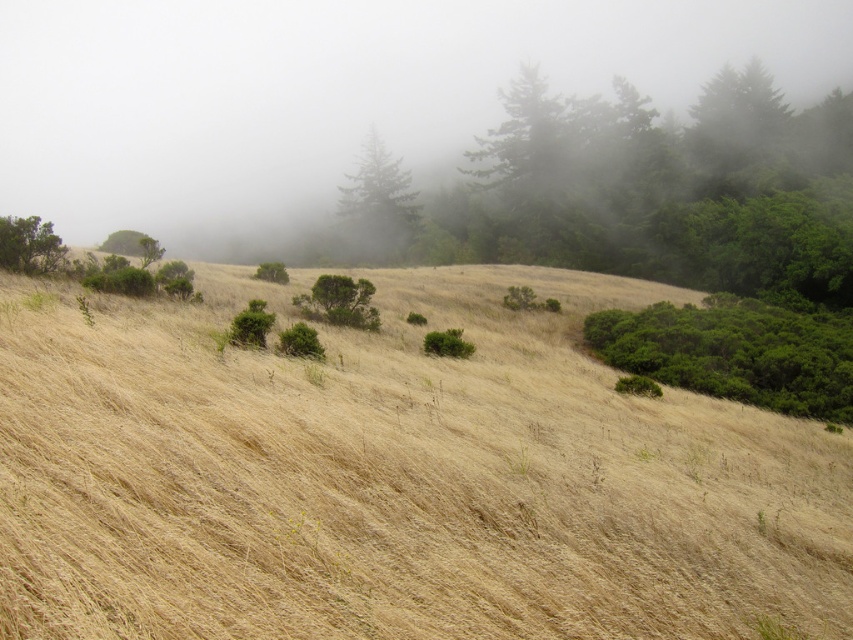
You are standing on the rolling hill and want to walk from the green leafy shrub at center to the green leafy tree at upper left. Which direction should you head to move away from the shrub and towards the tree?

To move from the green leafy shrub at center to the green leafy tree at upper left, you should head towards the upper left direction since the tree is located in that direction and the shrub is closer to you.

You are standing at the base of the hill and see two points marked on the landscape. The first point is at coordinates point (x=428, y=356) and the second is at point (x=346, y=200). If you want to walk towards the point that is closer to you, which coordinate should you head towards?

Point (x=428, y=356) is in front of point (x=346, y=200), so you should head towards point (x=428, y=356) as it is closer to you.